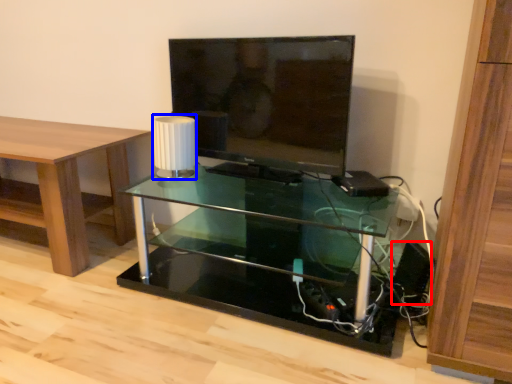
Question: Which of the following is the closest to the observer, speaker (highlighted by a red box) or lamp (highlighted by a blue box)?

Choices:
 (A) speaker
 (B) lamp

Answer: (A)